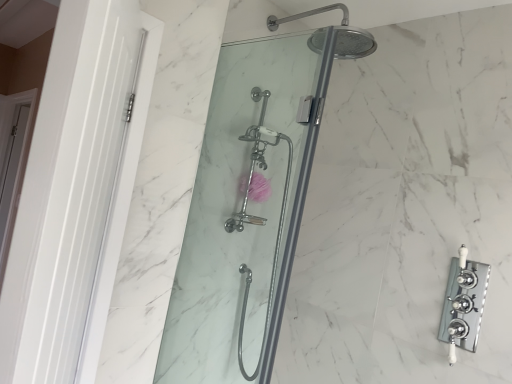
Image resolution: width=512 pixels, height=384 pixels. What do you see at coordinates (13, 159) in the screenshot?
I see `white glossy door at left, which ranks as the 1th screen door in back-to-front order` at bounding box center [13, 159].

Describe the element at coordinates (463, 304) in the screenshot. I see `chrome/polished metal faucet at right` at that location.

What do you see at coordinates (76, 192) in the screenshot? The height and width of the screenshot is (384, 512). I see `white glossy door at left, the 1th screen door when ordered from right to left` at bounding box center [76, 192].

Measure the distance between white glossy door at left, the 1th screen door when ordered from right to left, and camera.

They are 20.80 inches apart.

This screenshot has height=384, width=512. In order to click on clear glass shower door at center, placed as the first shower door when sorted from front to back in this screenshot , I will do `click(245, 212)`.

This screenshot has width=512, height=384. What are the coordinates of `clear glass shower door at center, which appears as the 1th shower door when viewed from the back` in the screenshot? It's located at (258, 216).

Locate an element on the screen. This screenshot has width=512, height=384. white glossy door at left, which ranks as the 1th screen door in back-to-front order is located at coordinates click(x=13, y=159).

From the picture: From a real-world perspective, is clear glass shower door at center, the 2th shower door viewed from the front, located higher than chrome/polished metal faucet at right?

No, from a real-world perspective, clear glass shower door at center, the 2th shower door viewed from the front, is not over chrome/polished metal faucet at right

Who is more distant, clear glass shower door at center, which appears as the 1th shower door when viewed from the back, or chrome/polished metal faucet at right?

clear glass shower door at center, which appears as the 1th shower door when viewed from the back.

Is clear glass shower door at center, which appears as the 1th shower door when viewed from the back, smaller than chrome/polished metal faucet at right?

Actually, clear glass shower door at center, which appears as the 1th shower door when viewed from the back, might be larger than chrome/polished metal faucet at right.

Is clear glass shower door at center, the 2th shower door viewed from the front, far from chrome/polished metal faucet at right?

No, clear glass shower door at center, the 2th shower door viewed from the front, is in close proximity to chrome/polished metal faucet at right.

From the image's perspective, is white glossy door at left, arranged as the 2th screen door when viewed from the back, positioned above or below clear glass shower door at center, placed as the first shower door when sorted from front to back?

Clearly, from the image's perspective, white glossy door at left, arranged as the 2th screen door when viewed from the back, is above clear glass shower door at center, placed as the first shower door when sorted from front to back.

Does white glossy door at left, the 1th screen door when ordered from right to left, appear on the left side of clear glass shower door at center, which is the second shower door in back-to-front order?

Yes, white glossy door at left, the 1th screen door when ordered from right to left, is to the left of clear glass shower door at center, which is the second shower door in back-to-front order.

The image size is (512, 384). Find the location of `screen door that is in front of the clear glass shower door at center, which is the second shower door in back-to-front order`. screen door that is in front of the clear glass shower door at center, which is the second shower door in back-to-front order is located at coordinates tap(76, 192).

What's the angular difference between white glossy door at left, which ranks as the 1th screen door in front-to-back order, and clear glass shower door at center, which is the second shower door in back-to-front order,'s facing directions?

white glossy door at left, which ranks as the 1th screen door in front-to-back order, and clear glass shower door at center, which is the second shower door in back-to-front order, are facing 31.3 degrees away from each other.

In the scene shown: Is pink fabric flower at center surrounded by chrome/polished metal faucet at right?

No, pink fabric flower at center is not surrounded by chrome/polished metal faucet at right.

Find the location of a particular element. This screenshot has height=384, width=512. lock in front of the pink fabric flower at center is located at coordinates click(463, 304).

Could you tell me if chrome/polished metal faucet at right is turned towards pink fabric flower at center?

No, chrome/polished metal faucet at right is not turned towards pink fabric flower at center.

Considering the points (259, 161) and (208, 284), which point is behind, point (259, 161) or point (208, 284)?

The point (259, 161) is farther.

Is clear glass shower door at center, which appears as the 1th shower door when viewed from the back, far away from clear glass shower door at center, placed as the first shower door when sorted from front to back?

No, clear glass shower door at center, which appears as the 1th shower door when viewed from the back, is not far from clear glass shower door at center, placed as the first shower door when sorted from front to back.

Is clear glass shower door at center, the 2th shower door viewed from the front, wider or thinner than clear glass shower door at center, which is the second shower door in back-to-front order?

Considering their sizes, clear glass shower door at center, the 2th shower door viewed from the front, looks broader than clear glass shower door at center, which is the second shower door in back-to-front order.

From the image's perspective, is white glossy door at left, arranged as the 2th screen door when viewed from the back, over clear glass shower door at center, the 2th shower door viewed from the front?

Yes, from the image's perspective, white glossy door at left, arranged as the 2th screen door when viewed from the back, is above clear glass shower door at center, the 2th shower door viewed from the front.

Does point (19, 328) come in front of point (238, 357)?

Yes.

From a real-world perspective, which is physically below, white glossy door at left, which ranks as the 1th screen door in front-to-back order, or clear glass shower door at center, which appears as the 1th shower door when viewed from the back?

clear glass shower door at center, which appears as the 1th shower door when viewed from the back.

Does chrome/polished metal faucet at right have a lesser height compared to clear glass shower door at center, which is the second shower door in back-to-front order?

Correct, chrome/polished metal faucet at right is not as tall as clear glass shower door at center, which is the second shower door in back-to-front order.

Considering the relative sizes of chrome/polished metal faucet at right and clear glass shower door at center, placed as the first shower door when sorted from front to back, in the image provided, is chrome/polished metal faucet at right bigger than clear glass shower door at center, placed as the first shower door when sorted from front to back,?

Actually, chrome/polished metal faucet at right might be smaller than clear glass shower door at center, placed as the first shower door when sorted from front to back.

Is chrome/polished metal faucet at right completely or partially outside of clear glass shower door at center, placed as the first shower door when sorted from front to back?

Yes, chrome/polished metal faucet at right is located beyond the bounds of clear glass shower door at center, placed as the first shower door when sorted from front to back.

Does point (461, 306) appear closer or farther from the camera than point (277, 116)?

Point (461, 306).

Consider the image. How distant is white glossy door at left, which ranks as the 1th screen door in back-to-front order, from white glossy door at left, marked as the 2th screen door in a left-to-right arrangement?

A distance of 4.53 feet exists between white glossy door at left, which ranks as the 1th screen door in back-to-front order, and white glossy door at left, marked as the 2th screen door in a left-to-right arrangement.

From the image's perspective, does white glossy door at left, the 2th screen door in the right-to-left sequence, appear higher than white glossy door at left, marked as the 2th screen door in a left-to-right arrangement?

Yes, from the image's perspective, white glossy door at left, the 2th screen door in the right-to-left sequence, is on top of white glossy door at left, marked as the 2th screen door in a left-to-right arrangement.

In the scene shown: Who is more distant, white glossy door at left, the 2th screen door in the right-to-left sequence, or white glossy door at left, marked as the 2th screen door in a left-to-right arrangement?

white glossy door at left, the 2th screen door in the right-to-left sequence, is behind.

In order to click on lock on the right of the clear glass shower door at center, the 2th shower door viewed from the front in this screenshot , I will do `click(463, 304)`.

What are the coordinates of `screen door above the clear glass shower door at center, placed as the first shower door when sorted from front to back (from a real-world perspective)` in the screenshot? It's located at (76, 192).

From the image, which object appears to be farther from white glossy door at left, the 1th screen door when ordered from right to left, white glossy door at left, marked as the first screen door in a left-to-right arrangement, or chrome/polished metal faucet at right?

The object further to white glossy door at left, the 1th screen door when ordered from right to left, is white glossy door at left, marked as the first screen door in a left-to-right arrangement.

In the scene shown: Which object lies nearer to the anchor point chrome/polished metal faucet at right, white glossy door at left, which ranks as the 1th screen door in back-to-front order, or pink fabric flower at center?

Based on the image, pink fabric flower at center appears to be nearer to chrome/polished metal faucet at right.

Consider the image. From the image, which object appears to be nearer to clear glass shower door at center, placed as the first shower door when sorted from front to back, white glossy door at left, which ranks as the 1th screen door in front-to-back order, or clear glass shower door at center, the 2th shower door viewed from the front?

clear glass shower door at center, the 2th shower door viewed from the front, lies closer to clear glass shower door at center, placed as the first shower door when sorted from front to back, than the other object.

Which object lies nearer to the anchor point clear glass shower door at center, the 2th shower door viewed from the front, pink fabric flower at center or clear glass shower door at center, placed as the first shower door when sorted from front to back?

clear glass shower door at center, placed as the first shower door when sorted from front to back, is closer to clear glass shower door at center, the 2th shower door viewed from the front.

Estimate the real-world distances between objects in this image. Which object is closer to chrome/polished metal faucet at right, pink fabric flower at center or clear glass shower door at center, which appears as the 1th shower door when viewed from the back?

The object closer to chrome/polished metal faucet at right is clear glass shower door at center, which appears as the 1th shower door when viewed from the back.

When comparing their distances from white glossy door at left, marked as the 2th screen door in a left-to-right arrangement, does clear glass shower door at center, which is the second shower door in back-to-front order, or clear glass shower door at center, which appears as the 1th shower door when viewed from the back, seem closer?

clear glass shower door at center, which is the second shower door in back-to-front order, is positioned closer to the anchor white glossy door at left, marked as the 2th screen door in a left-to-right arrangement.

From the image, which object appears to be nearer to white glossy door at left, marked as the first screen door in a left-to-right arrangement, white glossy door at left, marked as the 2th screen door in a left-to-right arrangement, or chrome/polished metal faucet at right?

Based on the image, white glossy door at left, marked as the 2th screen door in a left-to-right arrangement, appears to be nearer to white glossy door at left, marked as the first screen door in a left-to-right arrangement.

Consider the image. Looking at the image, which one is located further to pink fabric flower at center, white glossy door at left, arranged as the 2th screen door when viewed from the back, or clear glass shower door at center, which is the second shower door in back-to-front order?

The object further to pink fabric flower at center is white glossy door at left, arranged as the 2th screen door when viewed from the back.

You are a GUI agent. You are given a task and a screenshot of the screen. Output one action in this format:
    pyautogui.click(x=<x>, y=<y>)
    Task: Click on the flower located between white glossy door at left, marked as the 2th screen door in a left-to-right arrangement, and white glossy door at left, marked as the first screen door in a left-to-right arrangement, in the depth direction
    Image resolution: width=512 pixels, height=384 pixels.
    Given the screenshot: What is the action you would take?
    pyautogui.click(x=259, y=188)

Locate an element on the screen. Image resolution: width=512 pixels, height=384 pixels. shower door between white glossy door at left, arranged as the 2th screen door when viewed from the back, and clear glass shower door at center, the 2th shower door viewed from the front, from front to back is located at coordinates (245, 212).

I want to click on flower between white glossy door at left, positioned as the second screen door in front-to-back order, and chrome/polished metal faucet at right from left to right, so click(x=259, y=188).

At what (x,y) coordinates should I click in order to perform the action: click on flower between white glossy door at left, positioned as the second screen door in front-to-back order, and clear glass shower door at center, the 2th shower door viewed from the front, in the horizontal direction. Please return your answer as a coordinate pair (x, y). The image size is (512, 384). Looking at the image, I should click on (259, 188).